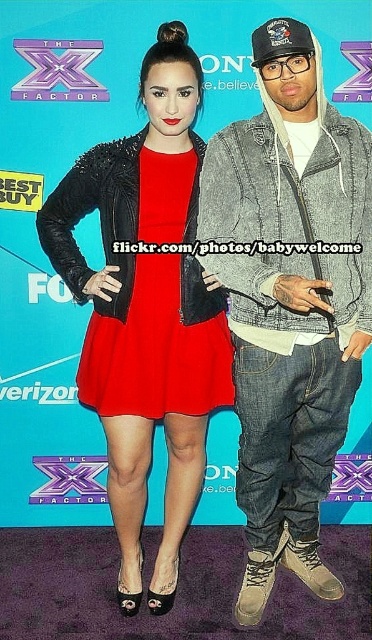
Question: Is denim jacket at center smaller than matte black dress at center?

Choices:
 (A) yes
 (B) no

Answer: (B)

Question: Among these points, which one is farthest from the camera?

Choices:
 (A) (136, 308)
 (B) (178, 358)
 (C) (249, 179)

Answer: (B)

Question: Which point appears farthest from the camera in this image?

Choices:
 (A) (123, 380)
 (B) (168, 90)
 (C) (309, 445)

Answer: (C)

Question: Can you confirm if denim jacket at center is positioned to the right of matte black dress at center?

Choices:
 (A) yes
 (B) no

Answer: (A)

Question: Does matte black dress at center appear on the left side of matte red dress at center?

Choices:
 (A) no
 (B) yes

Answer: (B)

Question: Which point is closer to the camera?

Choices:
 (A) (284, 532)
 (B) (155, 339)
 (C) (184, 300)

Answer: (C)